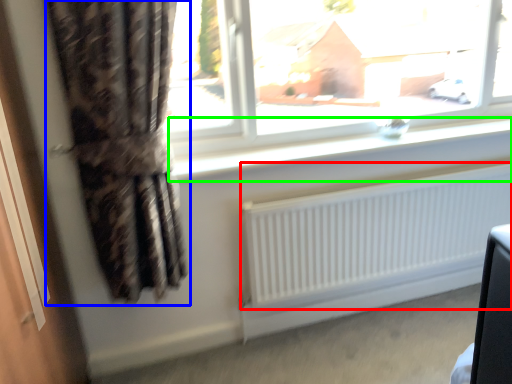
Question: Based on their relative distances, which object is farther from radiator (highlighted by a red box)? Choose from curtain (highlighted by a blue box) and window sill (highlighted by a green box).

Choices:
 (A) curtain
 (B) window sill

Answer: (A)